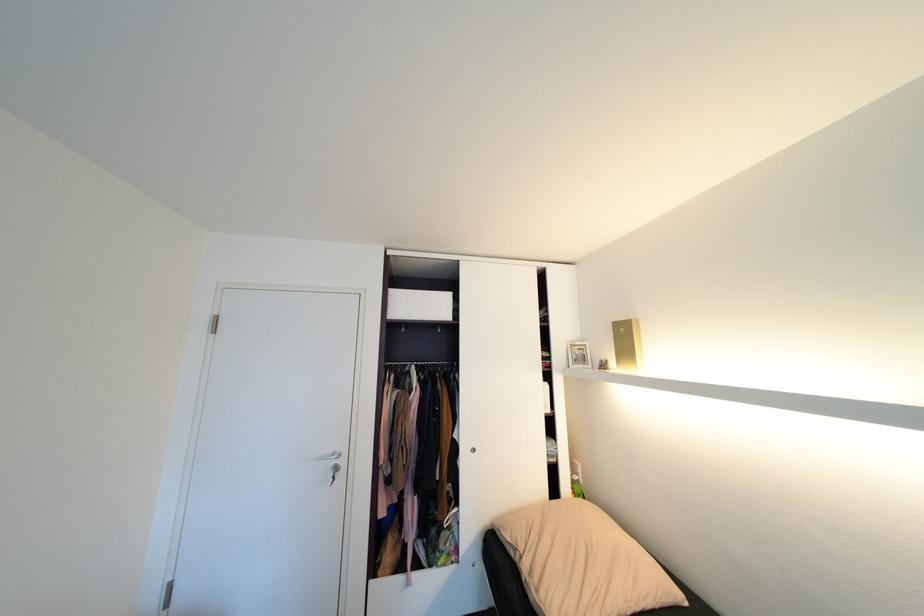
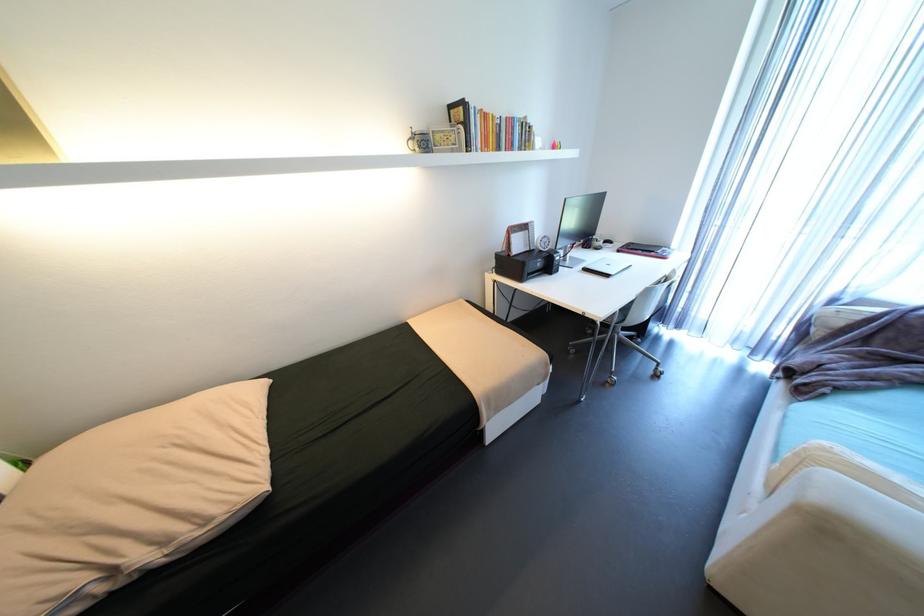
From the picture: First-person continuous shooting, in which direction is the camera rotating?

The camera rotated toward right-down.